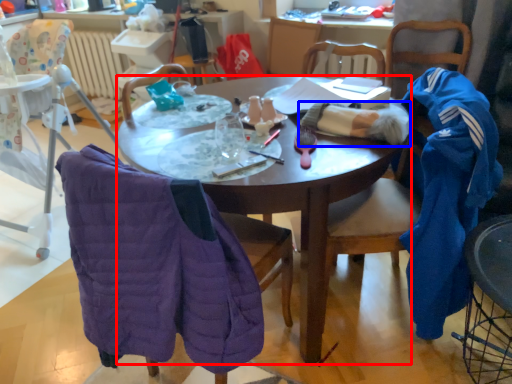
Question: Which object is further to the camera taking this photo, desk (highlighted by a red box) or clothing (highlighted by a blue box)?

Choices:
 (A) desk
 (B) clothing

Answer: (B)